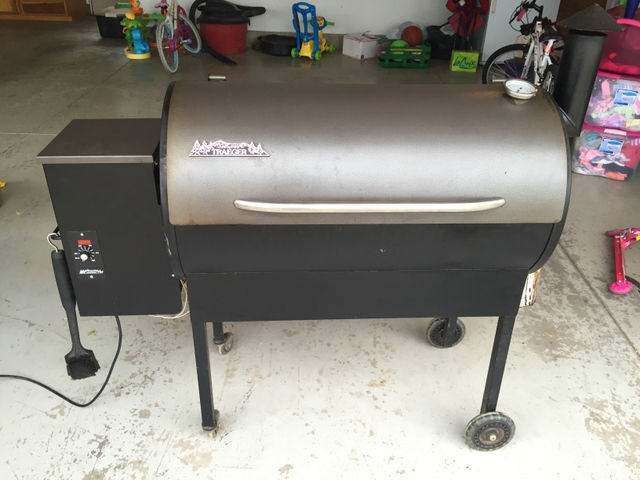
Locate an element on the screen. Image resolution: width=640 pixels, height=480 pixels. chimney is located at coordinates (589, 40).